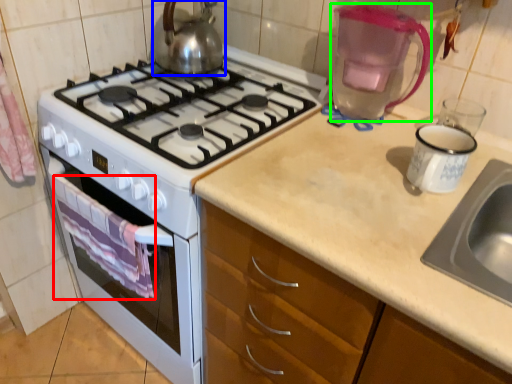
Question: Based on their relative distances, which object is farther from cloth (highlighted by a red box)? Choose from kettle (highlighted by a blue box) and coffeepot (highlighted by a green box).

Choices:
 (A) kettle
 (B) coffeepot

Answer: (B)